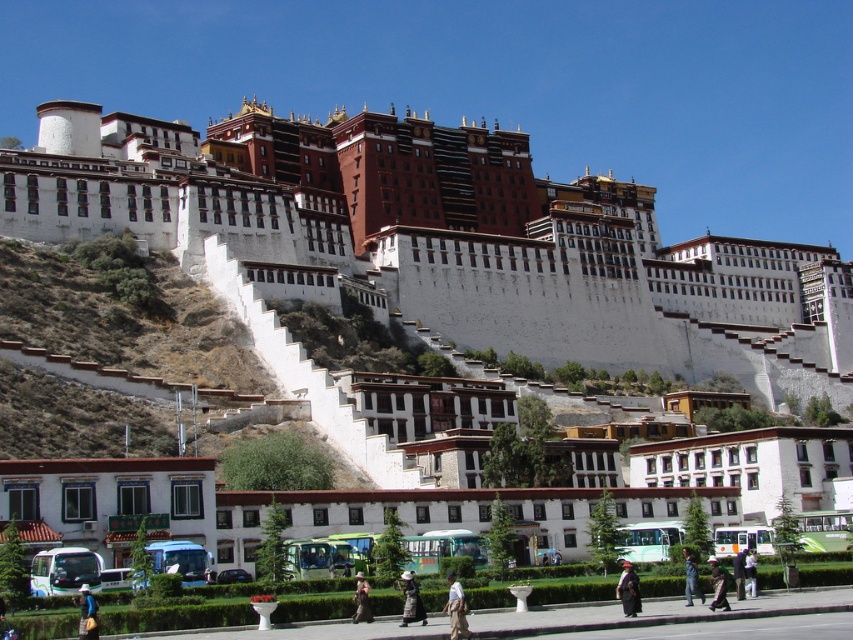
Does light brown fabric bag at lower left appear on the left side of dark brown fabric at lower right?

Correct, you'll find light brown fabric bag at lower left to the left of dark brown fabric at lower right.

Does light brown fabric bag at lower left lie in front of dark brown fabric at lower right?

Yes.

Identify the location of light brown fabric bag at lower left. The image size is (853, 640). (86, 614).

I want to click on light brown fabric bag at lower left, so click(86, 614).

Which is behind, point (624, 570) or point (421, 609)?

Point (624, 570)

Identify the location of dark gray fabric umbrella at lower center. This screenshot has width=853, height=640. (628, 589).

The image size is (853, 640). I want to click on dark gray fabric umbrella at lower center, so click(x=628, y=589).

Is dark blue uniform at lower center positioned before dark blue fabric coat at lower right?

Yes.

Can you confirm if dark blue uniform at lower center is positioned to the right of dark blue fabric coat at lower right?

In fact, dark blue uniform at lower center is to the left of dark blue fabric coat at lower right.

Measure the distance between dark blue uniform at lower center and camera.

dark blue uniform at lower center and camera are 52.23 meters apart.

You are a GUI agent. You are given a task and a screenshot of the screen. Output one action in this format:
    pyautogui.click(x=<x>, y=<y>)
    Task: Click on the dark blue uniform at lower center
    
    Given the screenshot: What is the action you would take?
    pyautogui.click(x=689, y=577)